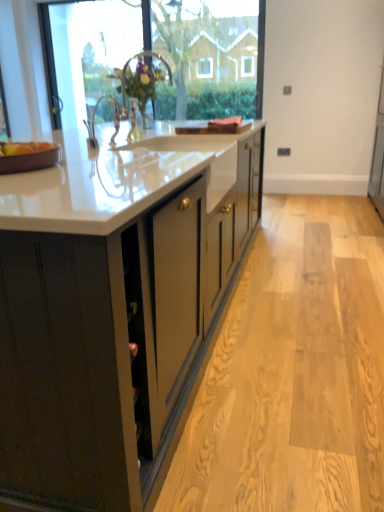
Question: Does matte black cabinets at center have a greater width compared to transparent glass door at upper left?

Choices:
 (A) yes
 (B) no

Answer: (A)

Question: Is matte black cabinets at center shorter than transparent glass door at upper left?

Choices:
 (A) no
 (B) yes

Answer: (B)

Question: Is matte black cabinets at center turned away from transparent glass door at upper left?

Choices:
 (A) no
 (B) yes

Answer: (A)

Question: Can we say matte black cabinets at center lies outside transparent glass door at upper left?

Choices:
 (A) yes
 (B) no

Answer: (A)

Question: Considering the relative positions of matte black cabinets at center and transparent glass door at upper left in the image provided, is matte black cabinets at center to the left of transparent glass door at upper left from the viewer's perspective?

Choices:
 (A) yes
 (B) no

Answer: (B)

Question: Is point (4, 143) closer or farther from the camera than point (1, 172)?

Choices:
 (A) closer
 (B) farther

Answer: (B)

Question: From the image's perspective, is matte brown apple at left located above or below brown matte tray at left?

Choices:
 (A) below
 (B) above

Answer: (B)

Question: Considering the relative positions of matte brown apple at left and brown matte tray at left in the image provided, is matte brown apple at left to the left or to the right of brown matte tray at left?

Choices:
 (A) left
 (B) right

Answer: (B)

Question: In terms of width, does matte brown apple at left look wider or thinner when compared to brown matte tray at left?

Choices:
 (A) thin
 (B) wide

Answer: (A)

Question: Do you think matte brown apple at left is within transparent glass window at upper center, or outside of it?

Choices:
 (A) inside
 (B) outside

Answer: (B)

Question: Is matte brown apple at left to the left or to the right of transparent glass window at upper center in the image?

Choices:
 (A) left
 (B) right

Answer: (A)

Question: In terms of size, does matte brown apple at left appear bigger or smaller than transparent glass window at upper center?

Choices:
 (A) big
 (B) small

Answer: (B)

Question: Considering the positions of matte brown apple at left and transparent glass window at upper center in the image, is matte brown apple at left wider or thinner than transparent glass window at upper center?

Choices:
 (A) thin
 (B) wide

Answer: (A)

Question: Is matte black cabinets at center spatially inside white glossy sink at upper center, or outside of it?

Choices:
 (A) outside
 (B) inside

Answer: (A)

Question: Considering the positions of matte black cabinets at center and white glossy sink at upper center in the image, is matte black cabinets at center wider or thinner than white glossy sink at upper center?

Choices:
 (A) thin
 (B) wide

Answer: (B)